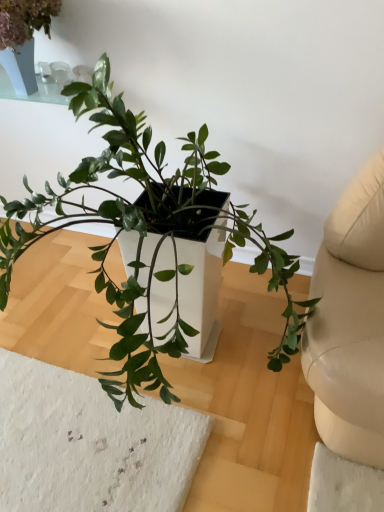
Question: Is green matte plant at upper left, the 2th houseplant viewed from the right, oriented towards green matte plant at center, the 2th houseplant viewed from the left?

Choices:
 (A) yes
 (B) no

Answer: (B)

Question: Are green matte plant at upper left, the 2th houseplant viewed from the right, and green matte plant at center, the 2th houseplant viewed from the left, beside each other?

Choices:
 (A) no
 (B) yes

Answer: (A)

Question: From a real-world perspective, is green matte plant at upper left, the 2th houseplant viewed from the right, on green matte plant at center, the 2th houseplant viewed from the left?

Choices:
 (A) no
 (B) yes

Answer: (B)

Question: Considering the relative sizes of green matte plant at upper left, the 2th houseplant viewed from the right, and green matte plant at center, the 2th houseplant viewed from the left, in the image provided, is green matte plant at upper left, the 2th houseplant viewed from the right, shorter than green matte plant at center, the 2th houseplant viewed from the left,?

Choices:
 (A) yes
 (B) no

Answer: (A)

Question: Is green matte plant at center, the 1th houseplant in the right-to-left sequence, inside green matte plant at upper left, the 2th houseplant viewed from the right?

Choices:
 (A) no
 (B) yes

Answer: (A)

Question: Can you confirm if green matte plant at upper left, the 2th houseplant viewed from the right, is thinner than green matte plant at center, the 1th houseplant in the right-to-left sequence?

Choices:
 (A) yes
 (B) no

Answer: (A)

Question: Is green matte plant at center, the 1th houseplant in the right-to-left sequence, thinner than green matte plant at upper left, the 1th houseplant from the left?

Choices:
 (A) no
 (B) yes

Answer: (A)

Question: Considering the relative positions of green matte plant at center, the 2th houseplant viewed from the left, and green matte plant at upper left, the 1th houseplant from the left, in the image provided, is green matte plant at center, the 2th houseplant viewed from the left, behind green matte plant at upper left, the 1th houseplant from the left,?

Choices:
 (A) yes
 (B) no

Answer: (B)

Question: Is green matte plant at center, the 1th houseplant in the right-to-left sequence, smaller than green matte plant at upper left, the 1th houseplant from the left?

Choices:
 (A) no
 (B) yes

Answer: (A)

Question: Could you tell me if green matte plant at center, the 2th houseplant viewed from the left, is turned towards green matte plant at upper left, the 1th houseplant from the left?

Choices:
 (A) no
 (B) yes

Answer: (A)

Question: From a real-world perspective, is green matte plant at center, the 1th houseplant in the right-to-left sequence, positioned over green matte plant at upper left, the 2th houseplant viewed from the right, based on gravity?

Choices:
 (A) yes
 (B) no

Answer: (B)

Question: Is point (100, 221) positioned closer to the camera than point (11, 54)?

Choices:
 (A) closer
 (B) farther

Answer: (A)